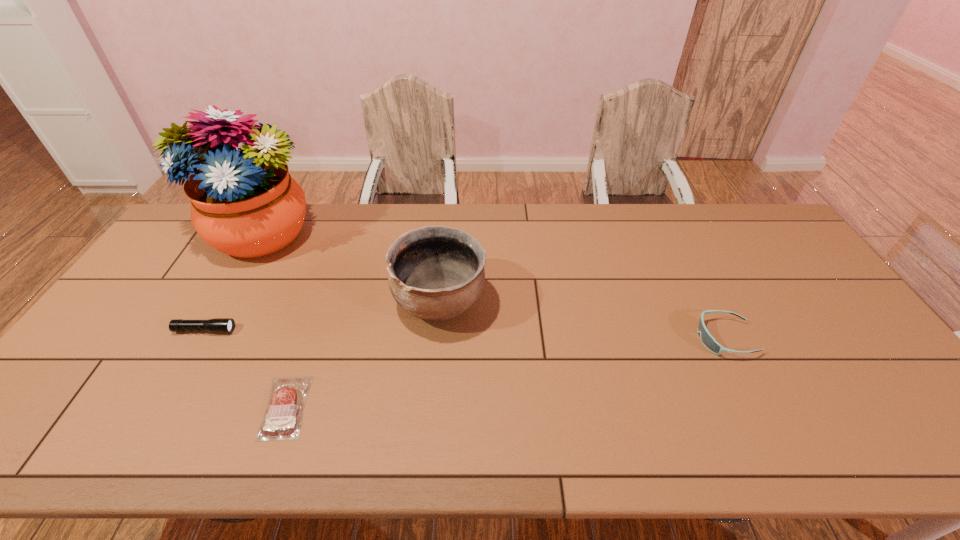
I want to click on vacant area located on the front-facing side of the goggles, so click(563, 338).

Image resolution: width=960 pixels, height=540 pixels. I want to click on free space located on the front-facing side of the goggles, so click(555, 338).

The width and height of the screenshot is (960, 540). What are the coordinates of `free space located on the front-facing side of the goggles` in the screenshot? It's located at (612, 338).

Where is `vacant space located at the lens end of the second shortest object`? vacant space located at the lens end of the second shortest object is located at coordinates (285, 330).

Locate an element on the screen. The width and height of the screenshot is (960, 540). free region located on the left of the shortest object is located at coordinates (211, 407).

This screenshot has width=960, height=540. Find the location of `object positioned at the far edge`. object positioned at the far edge is located at coordinates (244, 203).

This screenshot has width=960, height=540. What are the coordinates of `object at the near edge` in the screenshot? It's located at (282, 419).

This screenshot has width=960, height=540. What are the coordinates of `object located at the left edge` in the screenshot? It's located at (244, 203).

Locate an element on the screen. This screenshot has width=960, height=540. object situated at the far left corner is located at coordinates (244, 203).

The height and width of the screenshot is (540, 960). In the image, there is a desktop. In order to click on vacant space at the far edge in this screenshot , I will do `click(412, 212)`.